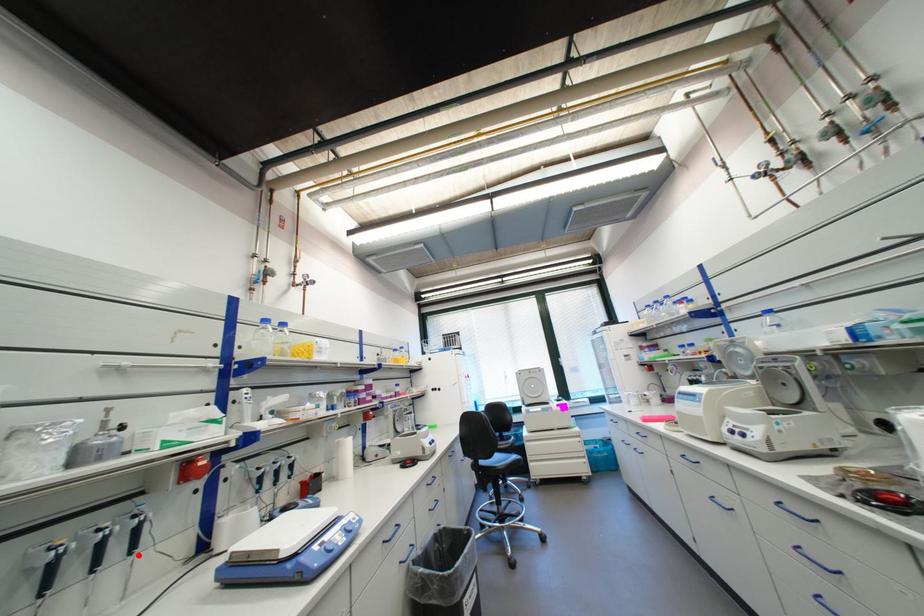
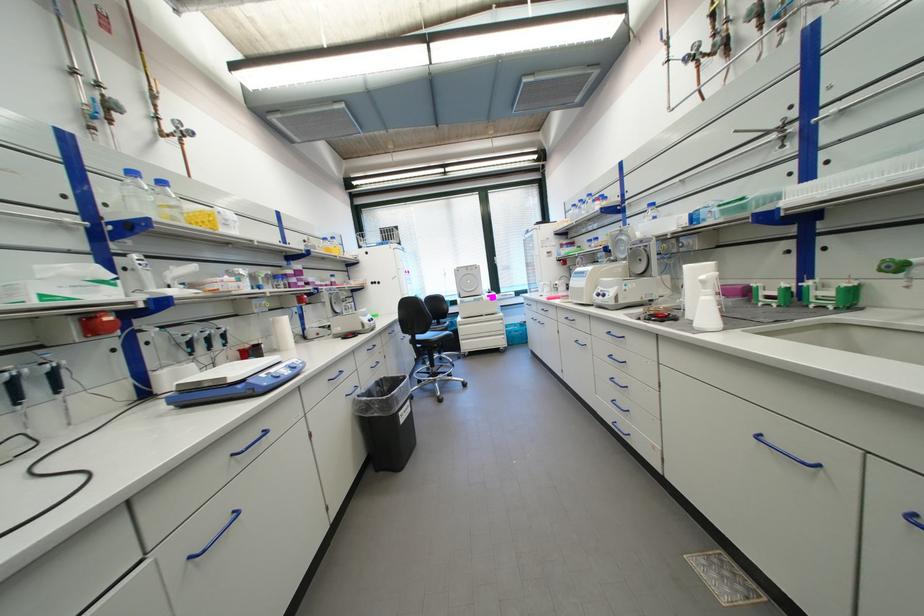
Locate, in the second image, the point that corresponds to the highlighted location in the first image.

(65, 394)